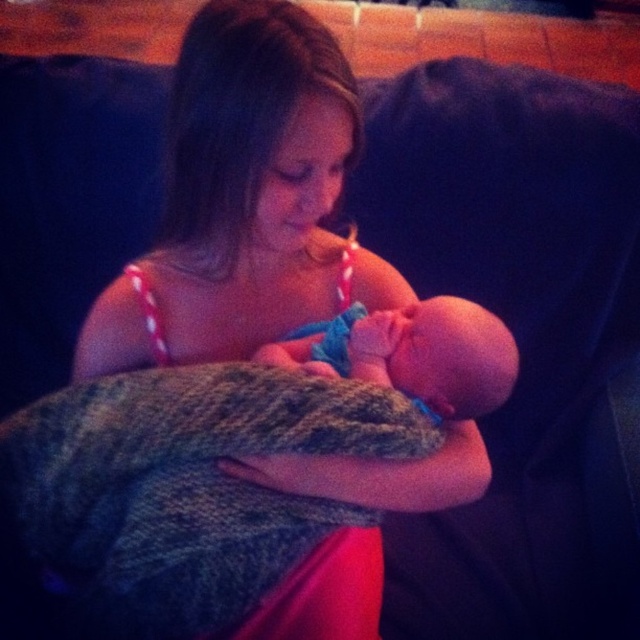
You are a photographer taking a portrait of the young girl and baby. You need to ensure the matte pink dress at center and the smooth skin newborn at center are both in focus. Since the dress is to the left of the newborn, where should you position your focus point?

You should position your focus point on the matte pink dress at center because it is closer to the camera than the smooth skin newborn at center, which is further away.

In the scene shown: You are a photographer taking a portrait of the young girl and baby. You need to ensure the baby is visible in the photo. Given the positions of the matte pink dress at center and the smooth skin newborn at center, will the baby be fully visible in the photo?

The matte pink dress at center is much taller than the smooth skin newborn at center, so the baby might be partially obscured by the dress in the photo.

From the picture: You are a photographer capturing this tender moment. To ensure the matte pink dress at center is visible without covering the smooth skin newborn at center, should you adjust the camera angle to look from above or below?

The matte pink dress at center is in front of the smooth skin newborn at center. To ensure visibility of both, adjust the camera angle to look from above so the dress doesn not block the newborn.